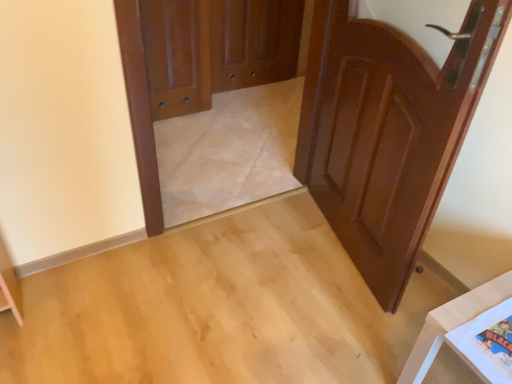
This screenshot has width=512, height=384. I want to click on vacant region under polished wood door at upper left, the 2th door from the right (from a real-world perspective), so click(x=187, y=117).